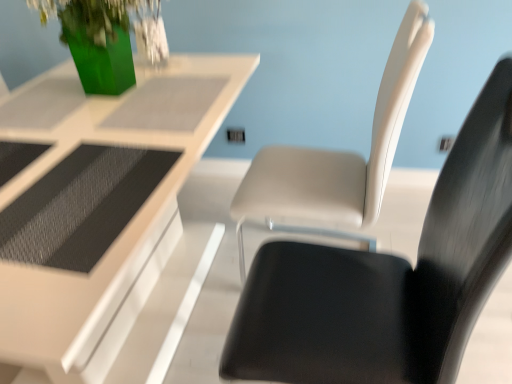
Question: Can we say matte white chair at center, placed as the first chair when sorted from back to front, lies outside matte white chair at center, positioned as the second chair in back-to-front order?

Choices:
 (A) yes
 (B) no

Answer: (A)

Question: Does matte white chair at center, acting as the 2th chair starting from the front, have a greater width compared to matte white chair at center, positioned as the first chair in front-to-back order?

Choices:
 (A) yes
 (B) no

Answer: (A)

Question: From a real-world perspective, does matte white chair at center, placed as the first chair when sorted from back to front, stand above matte white chair at center, positioned as the second chair in back-to-front order?

Choices:
 (A) yes
 (B) no

Answer: (A)

Question: Are matte white chair at center, acting as the 2th chair starting from the front, and matte white chair at center, positioned as the second chair in back-to-front order, far apart?

Choices:
 (A) yes
 (B) no

Answer: (B)

Question: Is the position of matte white chair at center, placed as the first chair when sorted from back to front, more distant than that of matte white chair at center, positioned as the second chair in back-to-front order?

Choices:
 (A) yes
 (B) no

Answer: (A)

Question: From a real-world perspective, relative to white glossy table at upper center, is matte white chair at center, acting as the 2th chair starting from the front, vertically above or below?

Choices:
 (A) below
 (B) above

Answer: (B)

Question: Would you say matte white chair at center, acting as the 2th chair starting from the front, is inside or outside white glossy table at upper center?

Choices:
 (A) inside
 (B) outside

Answer: (B)

Question: Is matte white chair at center, acting as the 2th chair starting from the front, in front of or behind white glossy table at upper center in the image?

Choices:
 (A) front
 (B) behind

Answer: (B)

Question: From the image's perspective, is matte white chair at center, acting as the 2th chair starting from the front, above or below white glossy table at upper center?

Choices:
 (A) above
 (B) below

Answer: (A)

Question: From the image's perspective, is white glossy table at upper center positioned above or below matte white chair at center, acting as the 2th chair starting from the front?

Choices:
 (A) above
 (B) below

Answer: (B)

Question: Is white glossy table at upper center taller or shorter than matte white chair at center, acting as the 2th chair starting from the front?

Choices:
 (A) short
 (B) tall

Answer: (A)

Question: From a real-world perspective, is white glossy table at upper center physically located above or below matte white chair at center, acting as the 2th chair starting from the front?

Choices:
 (A) below
 (B) above

Answer: (A)

Question: In the image, is white glossy table at upper center on the left side or the right side of matte white chair at center, placed as the first chair when sorted from back to front?

Choices:
 (A) right
 (B) left

Answer: (B)

Question: Is white glossy table at upper center wider or thinner than matte white chair at center, positioned as the first chair in front-to-back order?

Choices:
 (A) thin
 (B) wide

Answer: (B)

Question: Looking at the image, does white glossy table at upper center seem bigger or smaller compared to matte white chair at center, positioned as the second chair in back-to-front order?

Choices:
 (A) big
 (B) small

Answer: (A)